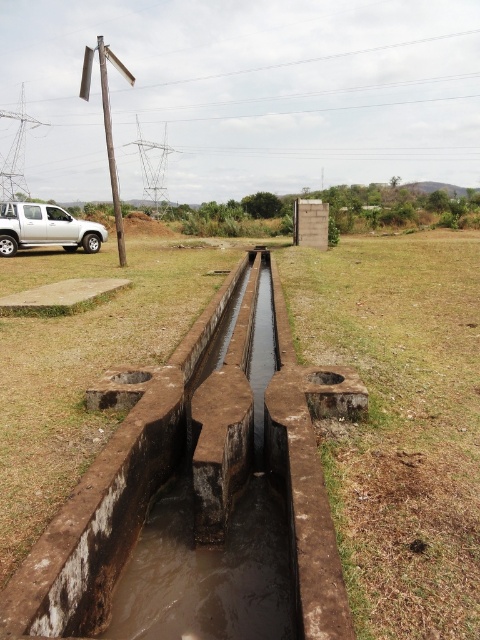
Who is higher up, brown dry grass at lower center or silver metallic truck at left?

silver metallic truck at left is above.

Who is positioned more to the right, brown dry grass at lower center or silver metallic truck at left?

brown dry grass at lower center is more to the right.

At what (x,y) coordinates should I click in order to perform the action: click on brown dry grass at lower center. Please return your answer as a coordinate pair (x, y). Looking at the image, I should click on (399, 422).

Locate an element on the screen. This screenshot has width=480, height=640. brown dry grass at lower center is located at coordinates (399, 422).